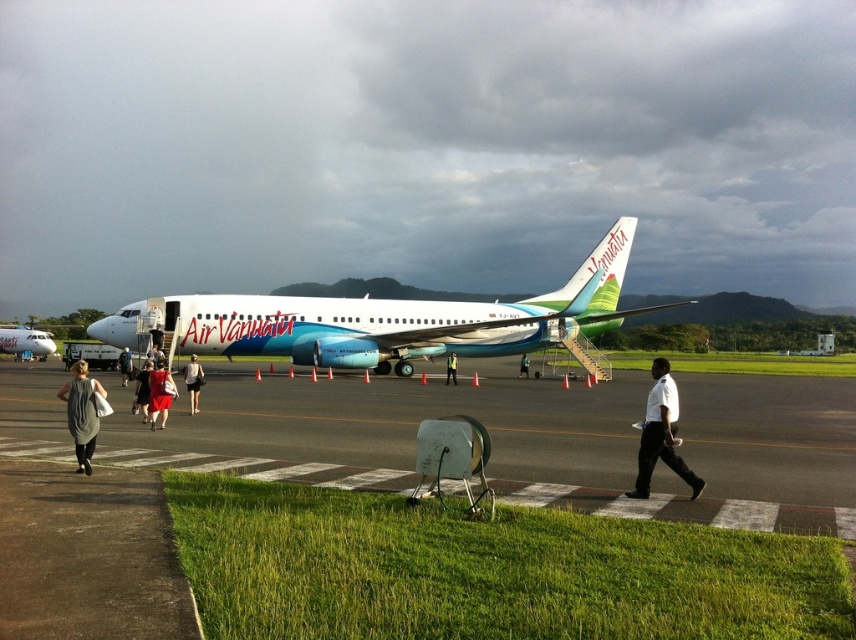
Between matte red dress at center and dark gray dress at center, which one appears on the right side from the viewer's perspective?

Positioned to the right is matte red dress at center.

Is matte red dress at center shorter than dark gray dress at center?

Yes.

Does point (153, 406) lie in front of point (146, 362)?

Yes, point (153, 406) is in front of point (146, 362).

What are the coordinates of `matte red dress at center` in the screenshot? It's located at (159, 394).

Can you confirm if matte white airplane at center is smaller than matte red dress at center?

Actually, matte white airplane at center might be larger than matte red dress at center.

Who is shorter, matte white airplane at center or matte red dress at center?

matte red dress at center

In the scene shown: Who is more distant from viewer, (39,337) or (156,385)?

The point (39,337) is more distant.

Identify the location of matte white airplane at center. Image resolution: width=856 pixels, height=640 pixels. (25, 340).

Is point (152, 385) positioned behind point (189, 396)?

That is False.

Who is positioned more to the right, matte red dress at center or denim shorts at center?

Positioned to the right is matte red dress at center.

I want to click on matte red dress at center, so click(x=159, y=394).